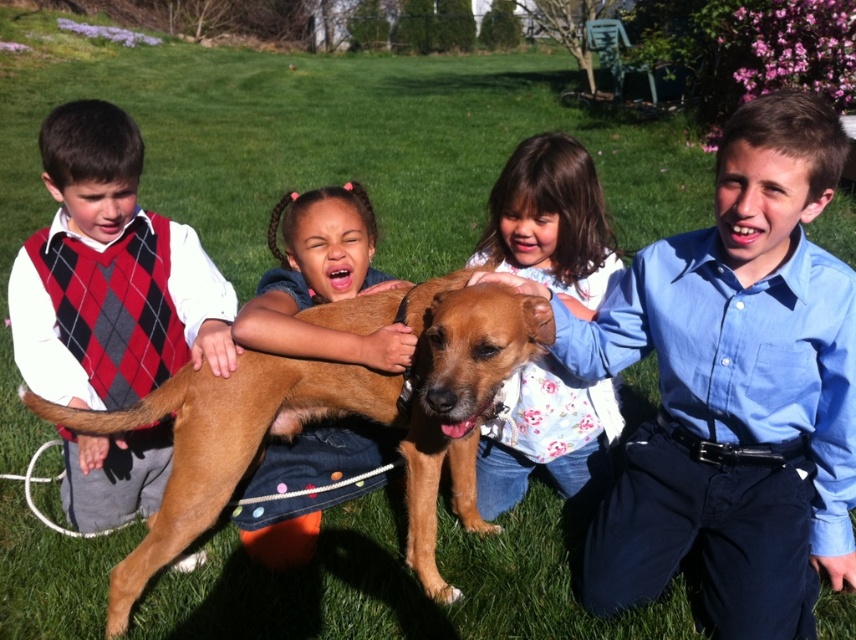
You are a photographer trying to capture a candid shot of the two children in the scene. You notice the blue cotton shirt at right and the argyle sweater vest at left. Which child is positioned lower in the frame?

The blue cotton shirt at right is located below the argyle sweater vest at left, so the child wearing the blue cotton shirt at right is positioned lower in the frame.

You are standing at the origin of the coordinate system in this image. You see two points, point (807,168) and point (152,269). Which point is closer to you?

Point (807,168) is in front of point (152,269), so it is closer to you.